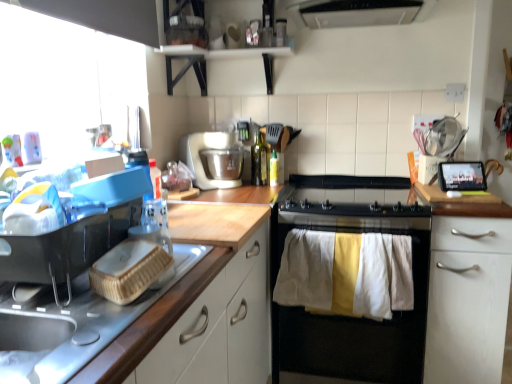
At what (x,y) coordinates should I click in order to perform the action: click on green glass bottle at center, the 1th bottle in the right-to-left sequence. Please return your answer as a coordinate pair (x, y). Looking at the image, I should click on (274, 169).

In order to face black glass gas stove at center, should I rotate leftwards or rightwards?

To face it directly, rotate right by 12.269 degrees.

The image size is (512, 384). Describe the element at coordinates (468, 299) in the screenshot. I see `white matte cabinet at right, arranged as the 1th cabinetry when viewed from the right` at that location.

Identify the location of white matte cabinet at right, arranged as the 1th cabinetry when viewed from the right. The height and width of the screenshot is (384, 512). (468, 299).

Where is `wooden countertop at left, which is the first cabinetry from left to right`? wooden countertop at left, which is the first cabinetry from left to right is located at coordinates (150, 322).

Are white plastic mixer at center and green glass bottle at center, which is counted as the 1th bottle, starting from the left, making contact?

There is a gap between white plastic mixer at center and green glass bottle at center, which is counted as the 1th bottle, starting from the left.

Which of these two, white plastic mixer at center or green glass bottle at center, which is counted as the 1th bottle, starting from the left, stands taller?

Standing taller between the two is green glass bottle at center, which is counted as the 1th bottle, starting from the left.

What are the coordinates of `bottle above the white plastic mixer at center (from a real-world perspective)` in the screenshot? It's located at (259, 160).

Does white plastic mixer at center have a lesser height compared to black matte stove at center?

Correct, white plastic mixer at center is not as tall as black matte stove at center.

Does point (231, 145) appear closer or farther from the camera than point (303, 373)?

Point (231, 145) is farther from the camera than point (303, 373).

Considering the relative positions of white plastic mixer at center and black matte stove at center in the image provided, is white plastic mixer at center to the left or to the right of black matte stove at center?

white plastic mixer at center is positioned on black matte stove at center's left side.

Considering the positions of objects white plastic mixer at center and black matte stove at center in the image provided, who is in front, white plastic mixer at center or black matte stove at center?

Positioned in front is black matte stove at center.

Is black glass gas stove at center thinner than white matte cabinet at right, the 1th cabinetry positioned from the back?

Incorrect, the width of black glass gas stove at center is not less than that of white matte cabinet at right, the 1th cabinetry positioned from the back.

Is white matte cabinet at right, arranged as the 1th cabinetry when viewed from the right, surrounded by black glass gas stove at center?

No, black glass gas stove at center does not contain white matte cabinet at right, arranged as the 1th cabinetry when viewed from the right.

Is black glass gas stove at center in front of or behind white matte cabinet at right, the 1th cabinetry positioned from the back, in the image?

Clearly, black glass gas stove at center is behind white matte cabinet at right, the 1th cabinetry positioned from the back.

Could you tell me if black glass gas stove at center is facing wooden countertop at left, which is the first cabinetry from left to right?

Yes, black glass gas stove at center is oriented towards wooden countertop at left, which is the first cabinetry from left to right.

Can you confirm if black glass gas stove at center is thinner than wooden countertop at left, which is the first cabinetry from left to right?

No.

From a real-world perspective, who is located lower, black glass gas stove at center or wooden countertop at left, the second cabinetry from the right?

wooden countertop at left, the second cabinetry from the right, from a real-world perspective.

How different are the orientations of black glass gas stove at center and wooden countertop at left, the second cabinetry when ordered from back to front, in degrees?

They differ by 90 degrees in their facing directions.

Is white plastic mixer at center surrounded by white matte cabinet at right, marked as the 2th cabinetry in a front-to-back arrangement?

No.

Is white matte cabinet at right, arranged as the 1th cabinetry when viewed from the right, wider or thinner than white plastic mixer at center?

Clearly, white matte cabinet at right, arranged as the 1th cabinetry when viewed from the right, has more width compared to white plastic mixer at center.

From a real-world perspective, is white matte cabinet at right, which is the 2th cabinetry in left-to-right order, over white plastic mixer at center?

No.

Is white plastic mixer at center facing away from white matte cabinet at right, the 1th cabinetry positioned from the back?

white plastic mixer at center is not turned away from white matte cabinet at right, the 1th cabinetry positioned from the back.

From the image's perspective, between white plastic mixer at center and white matte cabinet at right, which is the 2th cabinetry in left-to-right order, which one is located above?

white plastic mixer at center is shown above in the image.

Identify the location of kitchen appliance on the left of white matte cabinet at right, marked as the 2th cabinetry in a front-to-back arrangement. (205, 157).

Considering their positions, is white plastic mixer at center located in front of or behind white matte cabinet at right, marked as the 2th cabinetry in a front-to-back arrangement?

Clearly, white plastic mixer at center is behind white matte cabinet at right, marked as the 2th cabinetry in a front-to-back arrangement.

Is wooden countertop at left, which is the first cabinetry from left to right, wider than black glass gas stove at center?

In fact, wooden countertop at left, which is the first cabinetry from left to right, might be narrower than black glass gas stove at center.

Is wooden countertop at left, the second cabinetry from the right, far from black glass gas stove at center?

No, there isn't a large distance between wooden countertop at left, the second cabinetry from the right, and black glass gas stove at center.

Which object is further away from the camera taking this photo, wooden countertop at left, which is the first cabinetry from left to right, or black glass gas stove at center?

black glass gas stove at center is further away from the camera.

Where is `bottle that is the 1st object to the right of the white plastic mixer at center, starting at the anchor`? The image size is (512, 384). bottle that is the 1st object to the right of the white plastic mixer at center, starting at the anchor is located at coordinates (259, 160).

You are a GUI agent. You are given a task and a screenshot of the screen. Output one action in this format:
    pyautogui.click(x=<x>, y=<y>)
    Task: Click on the kitchen appliance above the black matte stove at center (from the image's perspective)
    The image size is (512, 384).
    Given the screenshot: What is the action you would take?
    pyautogui.click(x=205, y=157)

Considering their positions, is white plastic mixer at center positioned further to black glass gas stove at center than wooden countertop at left, the second cabinetry from the right?

wooden countertop at left, the second cabinetry from the right, lies further to black glass gas stove at center than the other object.

Based on the photo, based on their spatial positions, is green glass bottle at center, placed as the 2th bottle when sorted from left to right, or white plastic mixer at center closer to black glass gas stove at center?

Based on the image, white plastic mixer at center appears to be nearer to black glass gas stove at center.

Based on their spatial positions, is white plastic mixer at center or wooden countertop at left, which is the first cabinetry from left to right, further from green glass bottle at center, which is counted as the 1th bottle, starting from the left?

wooden countertop at left, which is the first cabinetry from left to right.

Consider the image. Which object lies nearer to the anchor point green glass bottle at center, positioned as the 2th bottle in right-to-left order, white plastic mixer at center or black matte stove at center?

white plastic mixer at center is closer to green glass bottle at center, positioned as the 2th bottle in right-to-left order.

From the image, which object appears to be farther from black matte stove at center, white matte cabinet at right, the 1th cabinetry positioned from the back, or green glass bottle at center, placed as the 2th bottle when sorted from left to right?

The object further to black matte stove at center is green glass bottle at center, placed as the 2th bottle when sorted from left to right.

When comparing their distances from wooden countertop at left, which is the first cabinetry from left to right, does white plastic mixer at center or black glass gas stove at center seem closer?

black glass gas stove at center is positioned closer to the anchor wooden countertop at left, which is the first cabinetry from left to right.

When comparing their distances from green glass bottle at center, placed as the 2th bottle when sorted from left to right, does white plastic mixer at center or white matte cabinet at right, which is the 2th cabinetry in left-to-right order, seem further?

white matte cabinet at right, which is the 2th cabinetry in left-to-right order, lies further to green glass bottle at center, placed as the 2th bottle when sorted from left to right, than the other object.

Which object lies nearer to the anchor point wooden countertop at left, the first cabinetry in the front-to-back sequence, white plastic mixer at center or green glass bottle at center, the 1th bottle in the right-to-left sequence?

white plastic mixer at center is positioned closer to the anchor wooden countertop at left, the first cabinetry in the front-to-back sequence.

This screenshot has height=384, width=512. Find the location of `gas stove between green glass bottle at center, which is counted as the 1th bottle, starting from the left, and white matte cabinet at right, arranged as the 1th cabinetry when viewed from the right, from left to right`. gas stove between green glass bottle at center, which is counted as the 1th bottle, starting from the left, and white matte cabinet at right, arranged as the 1th cabinetry when viewed from the right, from left to right is located at coordinates (350, 204).

Where is `home appliance between black glass gas stove at center and green glass bottle at center, placed as the 2th bottle when sorted from left to right, along the z-axis`? This screenshot has height=384, width=512. home appliance between black glass gas stove at center and green glass bottle at center, placed as the 2th bottle when sorted from left to right, along the z-axis is located at coordinates (351, 317).

Identify the location of kitchen appliance between green glass bottle at center, which is counted as the 1th bottle, starting from the left, and black matte stove at center from top to bottom. (205, 157).

Identify the location of home appliance between green glass bottle at center, the 1th bottle in the right-to-left sequence, and white matte cabinet at right, the 1th cabinetry positioned from the back, in the horizontal direction. This screenshot has width=512, height=384. (351, 317).